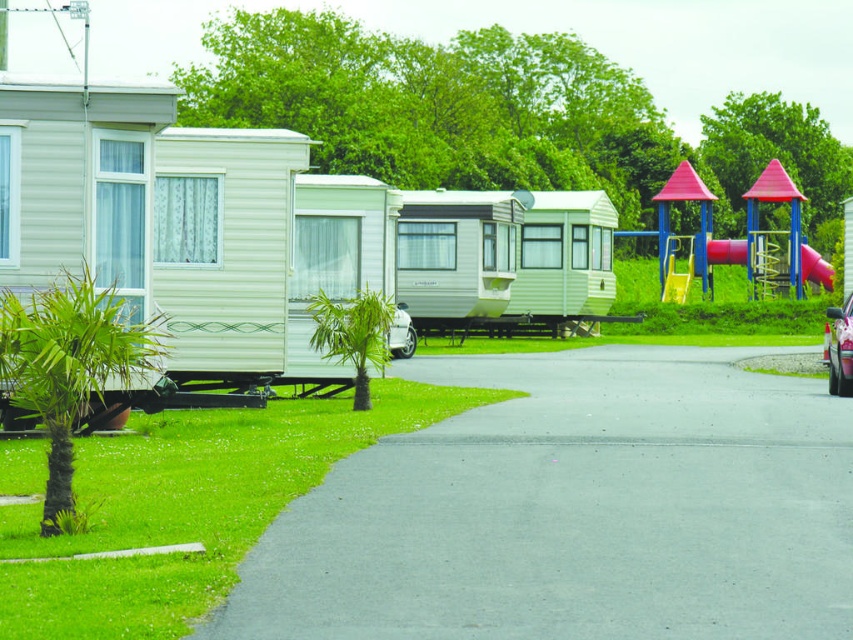
Question: Is asphalt at center further to camera compared to shiny metallic car at center?

Choices:
 (A) no
 (B) yes

Answer: (A)

Question: Among these objects, which one is nearest to the camera?

Choices:
 (A) shiny metallic car at center
 (B) asphalt at center

Answer: (B)

Question: Can you confirm if asphalt at center is smaller than shiny metallic car at center?

Choices:
 (A) yes
 (B) no

Answer: (B)

Question: Which point is farther to the camera?

Choices:
 (A) asphalt at center
 (B) shiny metallic car at center

Answer: (B)

Question: Which object is closer to the camera taking this photo?

Choices:
 (A) asphalt at center
 (B) shiny metallic car at center

Answer: (A)

Question: Considering the relative positions of asphalt at center and shiny metallic car at center in the image provided, where is asphalt at center located with respect to shiny metallic car at center?

Choices:
 (A) below
 (B) above

Answer: (A)